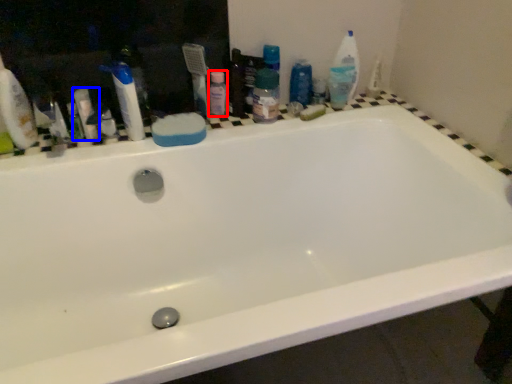
Question: Among these objects, which one is farthest to the camera, toiletry (highlighted by a red box) or toiletry (highlighted by a blue box)?

Choices:
 (A) toiletry
 (B) toiletry

Answer: (A)